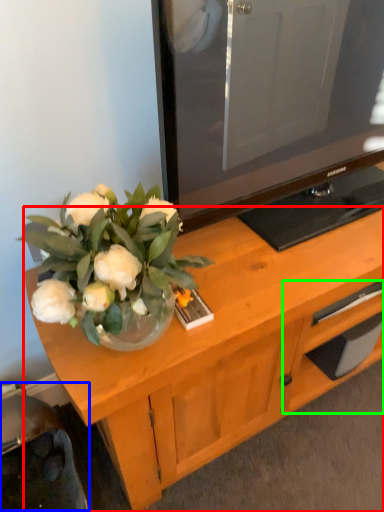
Question: Based on their relative distances, which object is farther from desk (highlighted by a red box)? Choose from swivel chair (highlighted by a blue box) and drawer (highlighted by a green box).

Choices:
 (A) swivel chair
 (B) drawer

Answer: (A)